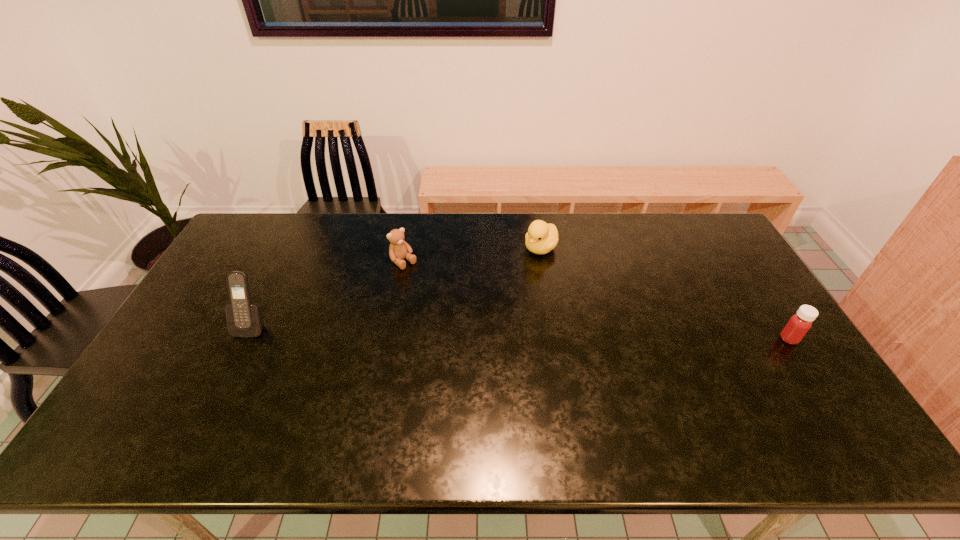
What are the coordinates of `object that is the nearest to the second object from left to right` in the screenshot? It's located at click(541, 238).

Identify which object is the closest to the duck. Please provide its 2D coordinates. Your answer should be formatted as a tuple, i.e. [(x, y)], where the tuple contains the x and y coordinates of a point satisfying the conditions above.

[(398, 250)]

This screenshot has height=540, width=960. Identify the location of blank space that satisfies the following two spatial constraints: 1. on the front-facing side of the tallest object; 2. on the right side of the medicine. (245, 339).

Where is `free space that satisfies the following two spatial constraints: 1. on the front-facing side of the cellular telephone; 2. on the left side of the medicine`? This screenshot has height=540, width=960. free space that satisfies the following two spatial constraints: 1. on the front-facing side of the cellular telephone; 2. on the left side of the medicine is located at coordinates (245, 339).

I want to click on vacant space that satisfies the following two spatial constraints: 1. on the front-facing side of the medicine; 2. on the right side of the leftmost object, so click(x=245, y=339).

Find the location of `vacant point that satisfies the following two spatial constraints: 1. on the front side of the third object from left to right; 2. on the right side of the rightmost object`. vacant point that satisfies the following two spatial constraints: 1. on the front side of the third object from left to right; 2. on the right side of the rightmost object is located at coordinates (555, 339).

The width and height of the screenshot is (960, 540). I want to click on vacant position in the image that satisfies the following two spatial constraints: 1. on the front side of the medicine; 2. on the right side of the teddy bear, so click(390, 339).